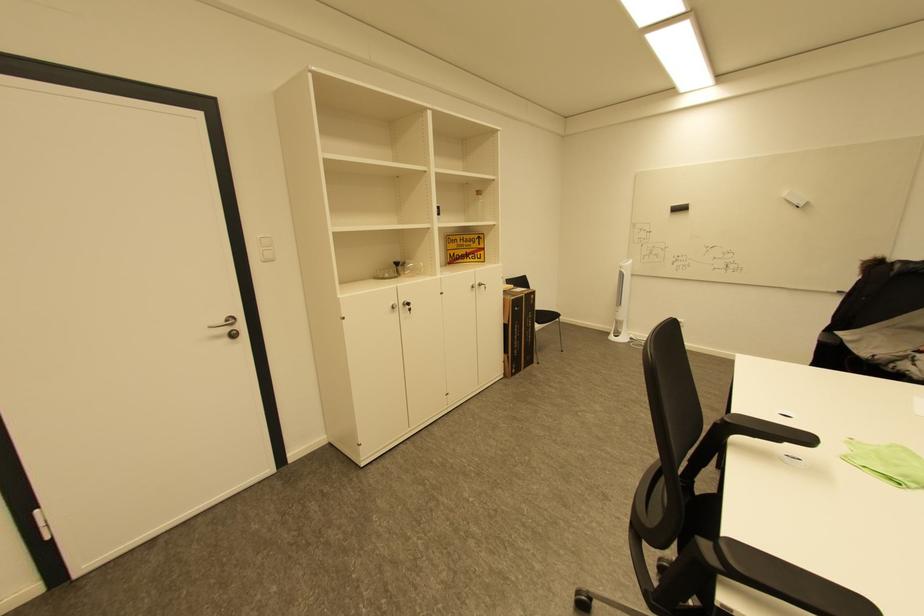
Where is `green cloth`? green cloth is located at coordinates tap(886, 463).